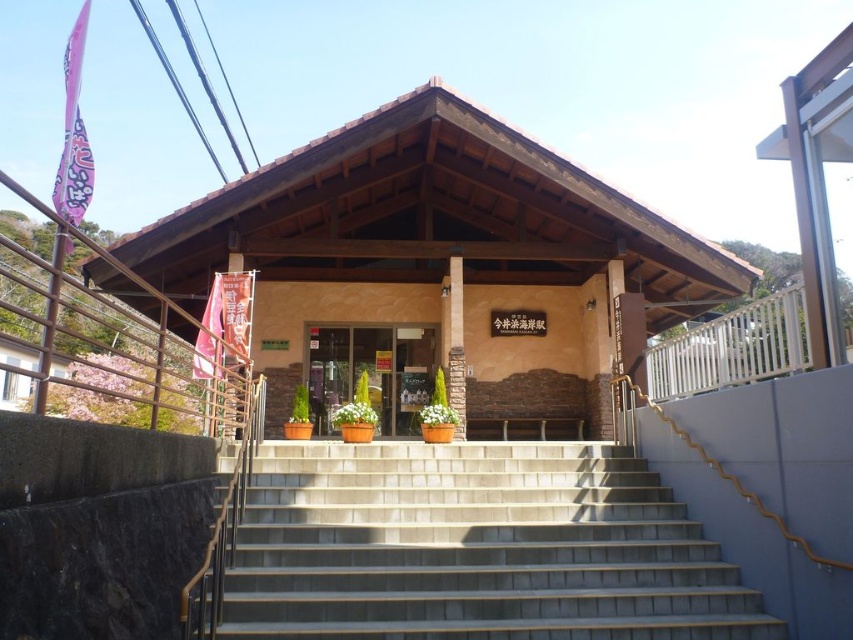
You are standing in front of the traditional building and want to enter through the entrance. Which object, the gray concrete stairs at center or the brown wooden pillar at center, is closer to you as you approach the building?

The gray concrete stairs at center are closer to the viewer than the brown wooden pillar at center, so the gray concrete stairs at center is closer to you as you approach the building.